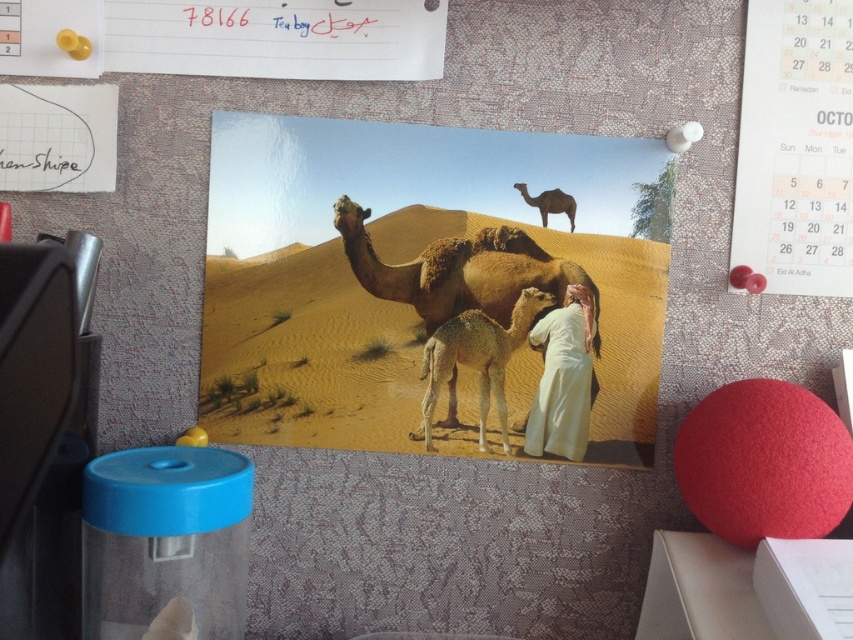
Question: Does brown matte camel at center have a lesser width compared to brown fuzzy camel at center?

Choices:
 (A) yes
 (B) no

Answer: (B)

Question: Among these objects, which one is farthest from the camera?

Choices:
 (A) brown matte camel at center
 (B) white paper calendar at upper right

Answer: (A)

Question: Is white paper calendar at upper right below brown matte camel at upper center?

Choices:
 (A) yes
 (B) no

Answer: (B)

Question: Estimate the real-world distances between objects in this image. Which object is farther from the brown fuzzy camel at center?

Choices:
 (A) white paper calendar at upper right
 (B) brown matte camel at upper center

Answer: (A)

Question: Among these objects, which one is farthest from the camera?

Choices:
 (A) brown matte camel at center
 (B) brown matte camel at upper center
 (C) brown fuzzy camel at center

Answer: (C)

Question: Does white cotton cloth at center appear under brown matte camel at upper center?

Choices:
 (A) no
 (B) yes

Answer: (B)